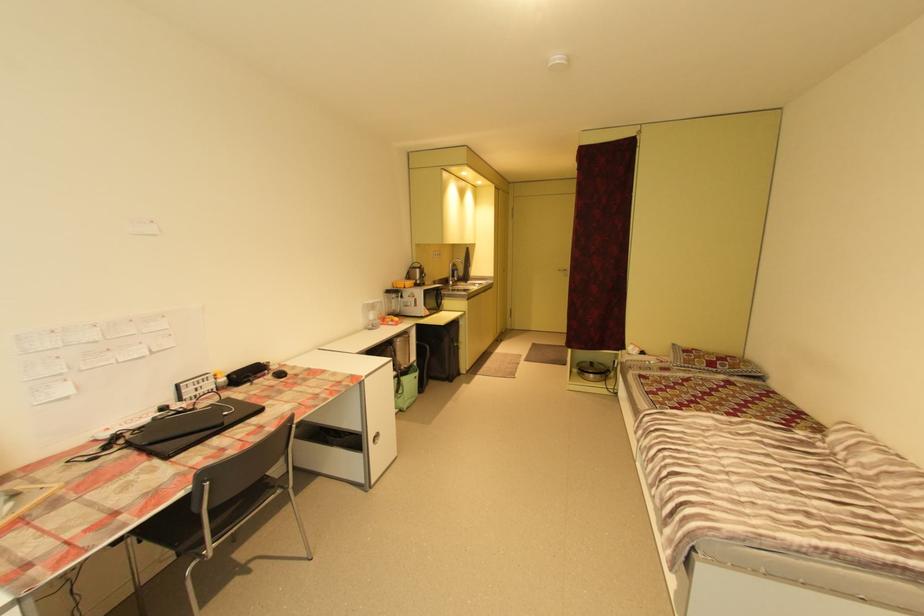
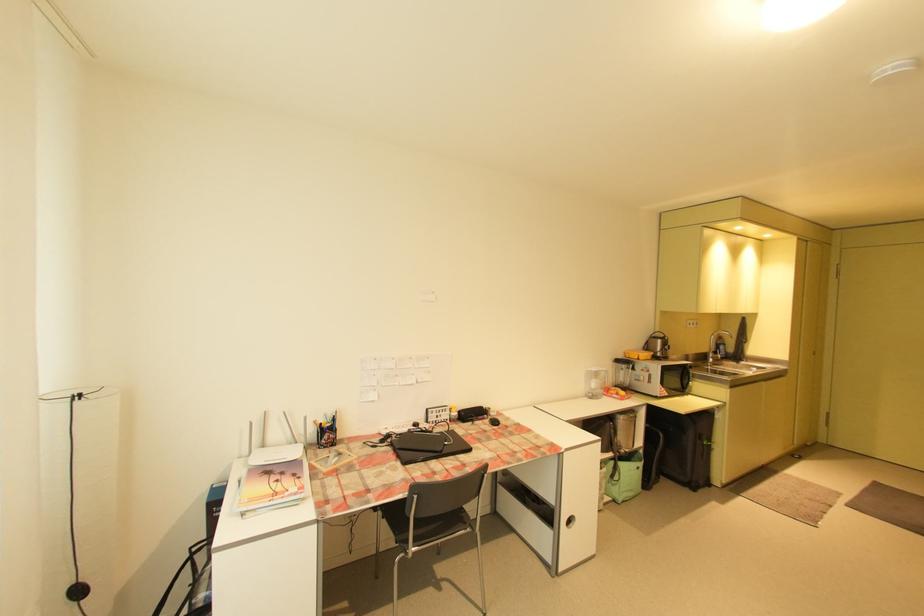
Question: I am providing you with two images of the same scene from different viewpoints. Please identify which objects are invisible in image2.

Choices:
 (A) black computer mouse
 (B) microwave door handle
 (C) kettle handle
 (D) none of these

Answer: (D)